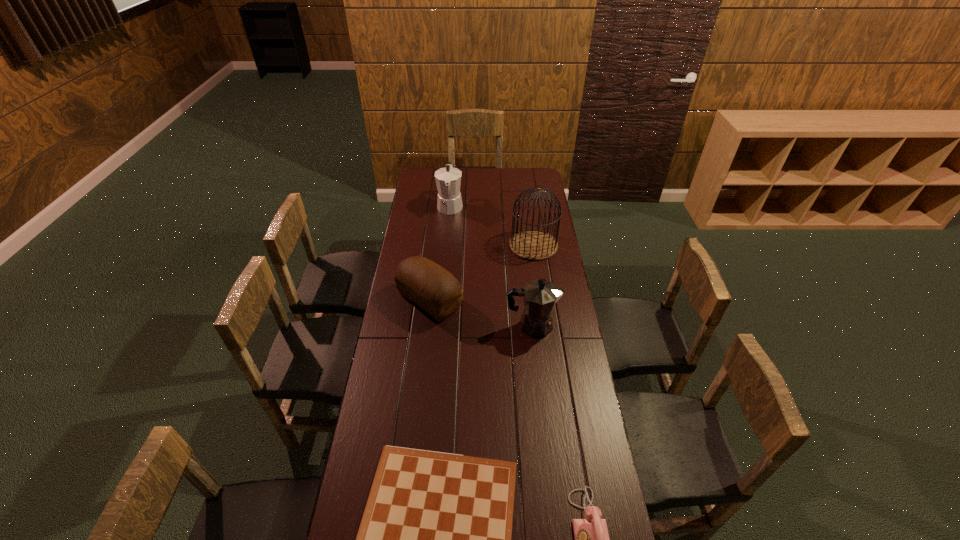
Locate an element on the screen. The height and width of the screenshot is (540, 960). free space between the fifth nearest object and the fourth tallest object is located at coordinates (482, 273).

Where is `object that is the third closest one to the third shortest object`? object that is the third closest one to the third shortest object is located at coordinates (448, 180).

You are a GUI agent. You are given a task and a screenshot of the screen. Output one action in this format:
    pyautogui.click(x=<x>, y=<y>)
    Task: Click on the object that is the fourth closest to the tallest object
    The width and height of the screenshot is (960, 540).
    Given the screenshot: What is the action you would take?
    click(x=435, y=538)